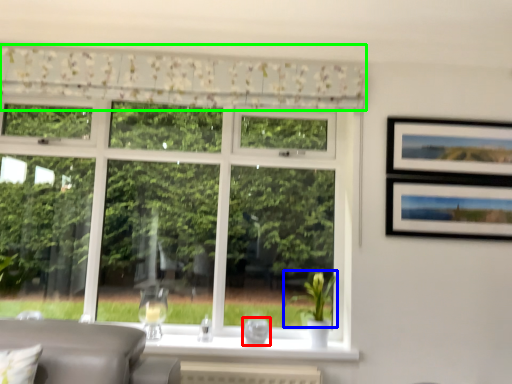
Question: Considering the real-world distances, which object is closest to glass vase (highlighted by a red box)? plant (highlighted by a blue box) or curtain (highlighted by a green box).

Choices:
 (A) plant
 (B) curtain

Answer: (A)